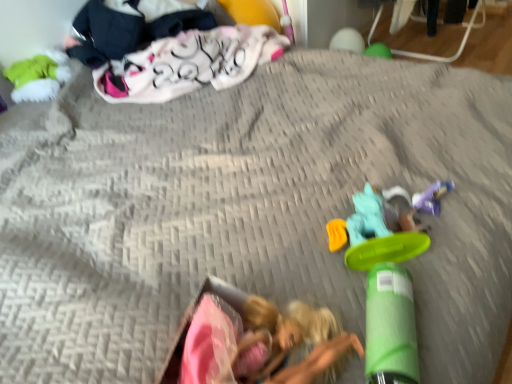
At what (x,y) coordinates should I click in order to perform the action: click on purple plastic toy at lower right, placed as the 2th toy when sorted from top to bottom. Please return your answer as a coordinate pair (x, y). Looking at the image, I should click on (432, 197).

How much space does purple plastic toy at lower right, which is counted as the first toy, starting from the right, occupy horizontally?

purple plastic toy at lower right, which is counted as the first toy, starting from the right, is 5.57 centimeters in width.

How much space does dark blue fabric at upper left, acting as the 1th clothing starting from the left, occupy vertically?

10.26 inches.

In order to click on translucent plastic toy at center, marked as the 2th toy in a bottom-to-top arrangement in this screenshot , I will do `click(384, 229)`.

This screenshot has height=384, width=512. I want to click on fluffy pink blanket at upper left, marked as the first clothing in a right-to-left arrangement, so click(188, 63).

Does point (411, 351) lie in front of point (420, 208)?

Yes, point (411, 351) is closer to viewer.

Identify the location of toy that is the 2nd object located below the purple plastic toy at lower right, which is the 4th toy from left to right (from the image's perspective). The height and width of the screenshot is (384, 512). (390, 327).

Is green matte cylinder at lower right, which ranks as the second toy in left-to-right order, to the left or to the right of purple plastic toy at lower right, which is counted as the first toy, starting from the right, in the image?

Clearly, green matte cylinder at lower right, which ranks as the second toy in left-to-right order, is on the left of purple plastic toy at lower right, which is counted as the first toy, starting from the right, in the image.

Considering the sizes of translucent plastic toy at center, which is counted as the third toy, starting from the left, and fluffy pink blanket at upper left, marked as the first clothing in a right-to-left arrangement, in the image, is translucent plastic toy at center, which is counted as the third toy, starting from the left, bigger or smaller than fluffy pink blanket at upper left, marked as the first clothing in a right-to-left arrangement,?

In the image, translucent plastic toy at center, which is counted as the third toy, starting from the left, appears to be smaller than fluffy pink blanket at upper left, marked as the first clothing in a right-to-left arrangement.

Can you confirm if translucent plastic toy at center, which ranks as the third toy in back-to-front order, is thinner than fluffy pink blanket at upper left, marked as the first clothing in a right-to-left arrangement?

Yes, translucent plastic toy at center, which ranks as the third toy in back-to-front order, is thinner than fluffy pink blanket at upper left, marked as the first clothing in a right-to-left arrangement.

Is translucent plastic toy at center, arranged as the 3th toy when viewed from the top, oriented towards fluffy pink blanket at upper left, marked as the first clothing in a right-to-left arrangement?

Yes, translucent plastic toy at center, arranged as the 3th toy when viewed from the top, is facing fluffy pink blanket at upper left, marked as the first clothing in a right-to-left arrangement.

Is translucent plastic toy at center, placed as the second toy when sorted from right to left, shorter than fluffy pink blanket at upper left, marked as the first clothing in a right-to-left arrangement?

Yes.

Is fluffy pink blanket at upper left, marked as the first clothing in a right-to-left arrangement, facing away from purple plastic toy at lower right, placed as the 2th toy when sorted from top to bottom?

No, purple plastic toy at lower right, placed as the 2th toy when sorted from top to bottom, is not at the back of fluffy pink blanket at upper left, marked as the first clothing in a right-to-left arrangement.

Considering the relative sizes of fluffy pink blanket at upper left, the second clothing viewed from the left, and purple plastic toy at lower right, which is the 4th toy from left to right, in the image provided, is fluffy pink blanket at upper left, the second clothing viewed from the left, thinner than purple plastic toy at lower right, which is the 4th toy from left to right,?

In fact, fluffy pink blanket at upper left, the second clothing viewed from the left, might be wider than purple plastic toy at lower right, which is the 4th toy from left to right.

How much distance is there between fluffy pink blanket at upper left, marked as the first clothing in a right-to-left arrangement, and purple plastic toy at lower right, marked as the third toy in a bottom-to-top arrangement?

A distance of 38.30 inches exists between fluffy pink blanket at upper left, marked as the first clothing in a right-to-left arrangement, and purple plastic toy at lower right, marked as the third toy in a bottom-to-top arrangement.

Which of these two, fluffy pink blanket at upper left, marked as the first clothing in a right-to-left arrangement, or purple plastic toy at lower right, which is counted as the first toy, starting from the right, is bigger?

With larger size is fluffy pink blanket at upper left, marked as the first clothing in a right-to-left arrangement.

Which is in front, point (261, 56) or point (400, 252)?

Positioned in front is point (400, 252).

Would you say fluffy pink blanket at upper left, the second clothing viewed from the left, is outside translucent plastic toy at center, marked as the 2th toy in a bottom-to-top arrangement?

Yes.

From the image's perspective, between fluffy pink blanket at upper left, marked as the first clothing in a right-to-left arrangement, and translucent plastic toy at center, marked as the 2th toy in a bottom-to-top arrangement, which one is located above?

fluffy pink blanket at upper left, marked as the first clothing in a right-to-left arrangement, appears higher in the image.

Considering the positions of objects fluffy pink blanket at upper left, marked as the first clothing in a right-to-left arrangement, and translucent plastic toy at center, which ranks as the third toy in back-to-front order, in the image provided, who is behind, fluffy pink blanket at upper left, marked as the first clothing in a right-to-left arrangement, or translucent plastic toy at center, which ranks as the third toy in back-to-front order,?

fluffy pink blanket at upper left, marked as the first clothing in a right-to-left arrangement.

Considering the points (82, 35) and (412, 293), which point is in front, point (82, 35) or point (412, 293)?

The point (412, 293) is in front.

Looking at their sizes, would you say dark blue fabric at upper left, acting as the 1th clothing starting from the left, is wider or thinner than green matte cylinder at lower right, the 3th toy when ordered from right to left?

Considering their sizes, dark blue fabric at upper left, acting as the 1th clothing starting from the left, looks broader than green matte cylinder at lower right, the 3th toy when ordered from right to left.

Is dark blue fabric at upper left, which is counted as the second clothing, starting from the right, closer to the viewer compared to green matte cylinder at lower right, the 1th toy in the bottom-to-top sequence?

No, it is not.

Based on the photo, would you consider dark blue fabric at upper left, acting as the 1th clothing starting from the left, to be distant from green matte cylinder at lower right, the 3th toy when ordered from right to left?

dark blue fabric at upper left, acting as the 1th clothing starting from the left, is positioned a significant distance from green matte cylinder at lower right, the 3th toy when ordered from right to left.

This screenshot has height=384, width=512. There is a dark blue fabric at upper left, acting as the 1th clothing starting from the left. Find the location of `the 1st toy below it (from a real-world perspective)`. the 1st toy below it (from a real-world perspective) is located at coordinates (38, 76).

Which object is further away from the camera, matte green plush at upper left, arranged as the fourth toy when ordered from the bottom, or dark blue fabric at upper left, which is counted as the second clothing, starting from the right?

matte green plush at upper left, arranged as the fourth toy when ordered from the bottom, is further away from the camera.

In the scene shown: Is matte green plush at upper left, positioned as the 4th toy in front-to-back order, at the right side of dark blue fabric at upper left, which is counted as the second clothing, starting from the right?

Incorrect, matte green plush at upper left, positioned as the 4th toy in front-to-back order, is not on the right side of dark blue fabric at upper left, which is counted as the second clothing, starting from the right.

Can you confirm if purple plastic toy at lower right, which appears as the 3th toy when viewed from the front, is positioned to the left of dark blue fabric at upper left, which is counted as the second clothing, starting from the right?

In fact, purple plastic toy at lower right, which appears as the 3th toy when viewed from the front, is to the right of dark blue fabric at upper left, which is counted as the second clothing, starting from the right.

Considering the sizes of objects purple plastic toy at lower right, the second toy positioned from the back, and dark blue fabric at upper left, acting as the 1th clothing starting from the left, in the image provided, who is bigger, purple plastic toy at lower right, the second toy positioned from the back, or dark blue fabric at upper left, acting as the 1th clothing starting from the left,?

dark blue fabric at upper left, acting as the 1th clothing starting from the left, is bigger.

Is dark blue fabric at upper left, acting as the 1th clothing starting from the left, surrounded by purple plastic toy at lower right, which is the 4th toy from left to right?

No, dark blue fabric at upper left, acting as the 1th clothing starting from the left, is not inside purple plastic toy at lower right, which is the 4th toy from left to right.

Image resolution: width=512 pixels, height=384 pixels. There is a purple plastic toy at lower right, the second toy positioned from the back. Find the location of `the 2nd toy above it (from a real-world perspective)`. the 2nd toy above it (from a real-world perspective) is located at coordinates (390, 327).

Locate an element on the screen. The width and height of the screenshot is (512, 384). the 1st clothing to the left of the translucent plastic toy at center, arranged as the 3th toy when viewed from the top, counting from the anchor's position is located at coordinates (188, 63).

Consider the image. Which object lies nearer to the anchor point fluffy pink blanket at upper left, marked as the first clothing in a right-to-left arrangement, matte green plush at upper left, the 1th toy from the top, or dark blue fabric at upper left, which is counted as the second clothing, starting from the right?

dark blue fabric at upper left, which is counted as the second clothing, starting from the right, is closer to fluffy pink blanket at upper left, marked as the first clothing in a right-to-left arrangement.

From the picture: Which object lies nearer to the anchor point dark blue fabric at upper left, which is counted as the second clothing, starting from the right, translucent plastic toy at center, which ranks as the third toy in back-to-front order, or purple plastic toy at lower right, placed as the 2th toy when sorted from top to bottom?

translucent plastic toy at center, which ranks as the third toy in back-to-front order, lies closer to dark blue fabric at upper left, which is counted as the second clothing, starting from the right, than the other object.

Which object lies further to the anchor point translucent plastic toy at center, marked as the 2th toy in a bottom-to-top arrangement, dark blue fabric at upper left, which is counted as the second clothing, starting from the right, or green matte cylinder at lower right, the 1th toy in the bottom-to-top sequence?

The object further to translucent plastic toy at center, marked as the 2th toy in a bottom-to-top arrangement, is dark blue fabric at upper left, which is counted as the second clothing, starting from the right.

When comparing their distances from fluffy pink blanket at upper left, marked as the first clothing in a right-to-left arrangement, does green matte cylinder at lower right, which is the 4th toy from back to front, or dark blue fabric at upper left, acting as the 1th clothing starting from the left, seem further?

green matte cylinder at lower right, which is the 4th toy from back to front.

Based on their spatial positions, is fluffy pink blanket at upper left, the second clothing viewed from the left, or purple plastic toy at lower right, which is counted as the first toy, starting from the right, closer to translucent plastic toy at center, marked as the 2th toy in a bottom-to-top arrangement?

The object closer to translucent plastic toy at center, marked as the 2th toy in a bottom-to-top arrangement, is purple plastic toy at lower right, which is counted as the first toy, starting from the right.

When comparing their distances from green matte cylinder at lower right, positioned as the fourth toy in top-to-bottom order, does matte green plush at upper left, which is the first toy from left to right, or dark blue fabric at upper left, which is counted as the second clothing, starting from the right, seem further?

The object further to green matte cylinder at lower right, positioned as the fourth toy in top-to-bottom order, is matte green plush at upper left, which is the first toy from left to right.

Which object lies further to the anchor point matte green plush at upper left, acting as the 4th toy starting from the right, fluffy pink blanket at upper left, marked as the first clothing in a right-to-left arrangement, or translucent plastic toy at center, which is counted as the third toy, starting from the left?

The object further to matte green plush at upper left, acting as the 4th toy starting from the right, is translucent plastic toy at center, which is counted as the third toy, starting from the left.

Based on their spatial positions, is fluffy pink blanket at upper left, marked as the first clothing in a right-to-left arrangement, or matte green plush at upper left, positioned as the 4th toy in front-to-back order, further from dark blue fabric at upper left, acting as the 1th clothing starting from the left?

The object further to dark blue fabric at upper left, acting as the 1th clothing starting from the left, is matte green plush at upper left, positioned as the 4th toy in front-to-back order.

Locate an element on the screen. clothing between dark blue fabric at upper left, which is counted as the second clothing, starting from the right, and green matte cylinder at lower right, positioned as the fourth toy in top-to-bottom order, in the up-down direction is located at coordinates (188, 63).

This screenshot has height=384, width=512. I want to click on clothing that lies between dark blue fabric at upper left, acting as the 1th clothing starting from the left, and translucent plastic toy at center, which is counted as the third toy, starting from the left, from top to bottom, so click(188, 63).

Identify the location of toy situated between matte green plush at upper left, the 1th toy from the back, and translucent plastic toy at center, which is counted as the third toy, starting from the left, from left to right. (390, 327).

I want to click on clothing between matte green plush at upper left, which is the first toy from left to right, and fluffy pink blanket at upper left, marked as the first clothing in a right-to-left arrangement, from left to right, so click(129, 27).